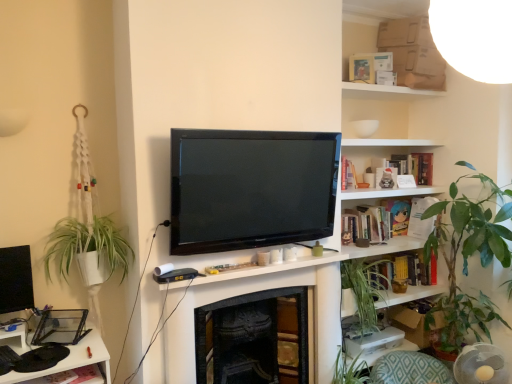
Question: Is white cardboard box at upper right oriented away from green leafy plant at right?

Choices:
 (A) no
 (B) yes

Answer: (A)

Question: Is green leafy plant at right inside white cardboard box at upper right?

Choices:
 (A) yes
 (B) no

Answer: (B)

Question: Is white cardboard box at upper right taller than green leafy plant at right?

Choices:
 (A) yes
 (B) no

Answer: (B)

Question: Could you tell me if white cardboard box at upper right is facing green leafy plant at right?

Choices:
 (A) no
 (B) yes

Answer: (A)

Question: Is white cardboard box at upper right closer to camera compared to green leafy plant at right?

Choices:
 (A) no
 (B) yes

Answer: (B)

Question: Is white paper at upper right, which appears as the second book when viewed from the top, bigger or smaller than hardcover book at upper right, placed as the first book when sorted from top to bottom?

Choices:
 (A) big
 (B) small

Answer: (B)

Question: From the image's perspective, is white paper at upper right, which appears as the 2th book when ordered from the bottom, above or below hardcover book at upper right, placed as the first book when sorted from top to bottom?

Choices:
 (A) below
 (B) above

Answer: (A)

Question: Would you say white paper at upper right, which appears as the 2th book when ordered from the bottom, is to the left or to the right of hardcover book at upper right, marked as the 3th book in a bottom-to-top arrangement, in the picture?

Choices:
 (A) right
 (B) left

Answer: (A)

Question: In terms of height, does white paper at upper right, which appears as the second book when viewed from the top, look taller or shorter compared to hardcover book at upper right, placed as the first book when sorted from top to bottom?

Choices:
 (A) short
 (B) tall

Answer: (B)

Question: Looking at their shapes, would you say hardcover book at upper right, marked as the 3th book in a bottom-to-top arrangement, is wider or thinner than white paper at upper right, which appears as the 2th book when ordered from the bottom?

Choices:
 (A) thin
 (B) wide

Answer: (A)

Question: Considering the positions of hardcover book at upper right, marked as the 3th book in a bottom-to-top arrangement, and white paper at upper right, which appears as the second book when viewed from the top, in the image, is hardcover book at upper right, marked as the 3th book in a bottom-to-top arrangement, taller or shorter than white paper at upper right, which appears as the second book when viewed from the top,?

Choices:
 (A) tall
 (B) short

Answer: (B)

Question: Do you think hardcover book at upper right, marked as the 3th book in a bottom-to-top arrangement, is within white paper at upper right, which appears as the second book when viewed from the top, or outside of it?

Choices:
 (A) inside
 (B) outside

Answer: (B)

Question: From the image's perspective, relative to white paper at upper right, which appears as the second book when viewed from the top, is hardcover book at upper right, marked as the 3th book in a bottom-to-top arrangement, above or below?

Choices:
 (A) above
 (B) below

Answer: (A)

Question: Considering the relative positions of hardcover book at upper right, marked as the 3th book in a bottom-to-top arrangement, and wooden bookshelf at upper right in the image provided, is hardcover book at upper right, marked as the 3th book in a bottom-to-top arrangement, to the left or to the right of wooden bookshelf at upper right?

Choices:
 (A) left
 (B) right

Answer: (B)

Question: Does point (401, 158) appear closer or farther from the camera than point (423, 291)?

Choices:
 (A) farther
 (B) closer

Answer: (A)